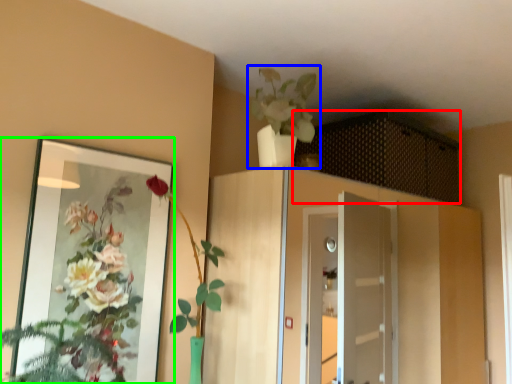
Question: Which object is the farthest from cabinetry (highlighted by a red box)? Choose among these: houseplant (highlighted by a blue box) or mirror (highlighted by a green box).

Choices:
 (A) houseplant
 (B) mirror

Answer: (B)